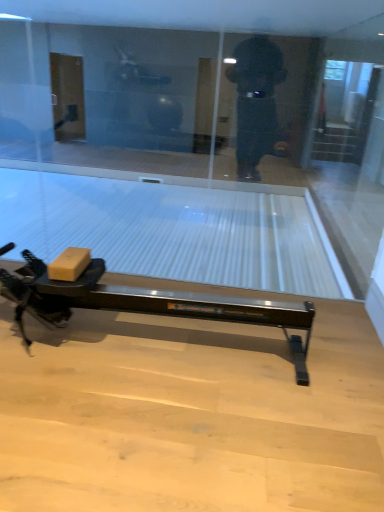
At what (x,y) coordinates should I click in order to perform the action: click on free space in front of transparent glass at center. Please return your answer as a coordinate pair (x, y). This screenshot has width=384, height=512. Looking at the image, I should click on (172, 388).